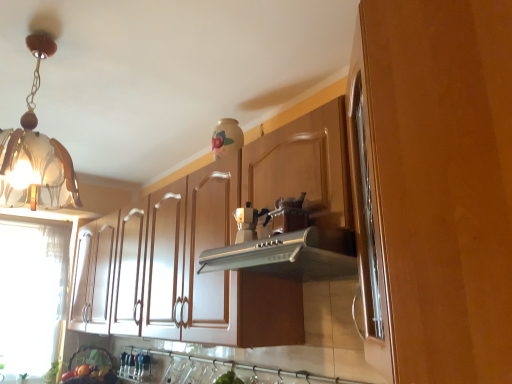
The width and height of the screenshot is (512, 384). I want to click on free space above translucent glass pendant light at upper left (from a real-world perspective), so click(x=52, y=36).